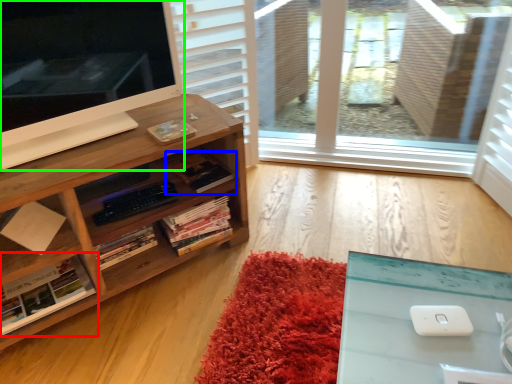
Question: Which object is positioned farthest from book (highlighted by a red box)? Select from book (highlighted by a blue box) and computer monitor (highlighted by a green box).

Choices:
 (A) book
 (B) computer monitor

Answer: (B)